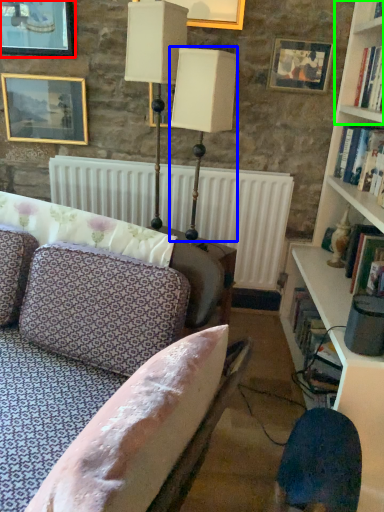
Question: Based on their relative distances, which object is farther from picture frame (highlighted by a red box)? Choose from table lamp (highlighted by a blue box) and shelf (highlighted by a green box).

Choices:
 (A) table lamp
 (B) shelf

Answer: (B)